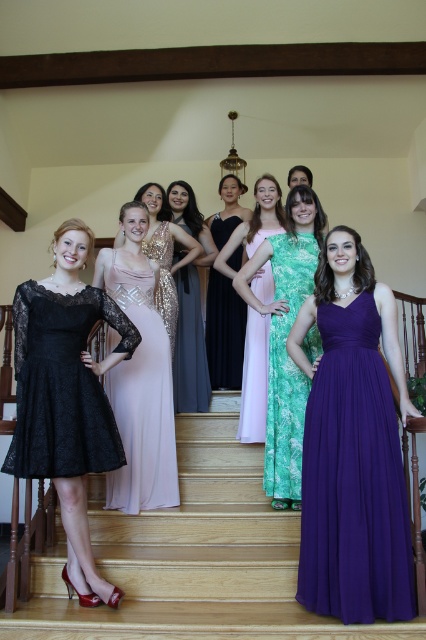
Does point (290, 616) come farther from viewer compared to point (43, 400)?

No, it is in front of (43, 400).

Which is more to the left, lace fabric dress at lower left or lace black dress at left?

From the viewer's perspective, lace black dress at left appears more on the left side.

Is point (192, 618) farther from viewer compared to point (74, 387)?

No, it is in front of (74, 387).

The width and height of the screenshot is (426, 640). I want to click on lace fabric dress at lower left, so click(x=192, y=557).

Can you confirm if light pink sequined dress at center is positioned below light pink satin dress at center?

Yes, light pink sequined dress at center is below light pink satin dress at center.

Where is `light pink sequined dress at center`? This screenshot has width=426, height=640. light pink sequined dress at center is located at coordinates (141, 397).

Is lace black dress at left positioned in front of light pink sequined dress at center?

Yes, lace black dress at left is closer to the viewer.

Is lace black dress at left to the left of light pink sequined dress at center from the viewer's perspective?

Indeed, lace black dress at left is positioned on the left side of light pink sequined dress at center.

Measure the distance between lace black dress at left and camera.

lace black dress at left and camera are 2.52 meters apart from each other.

I want to click on lace black dress at left, so click(x=63, y=385).